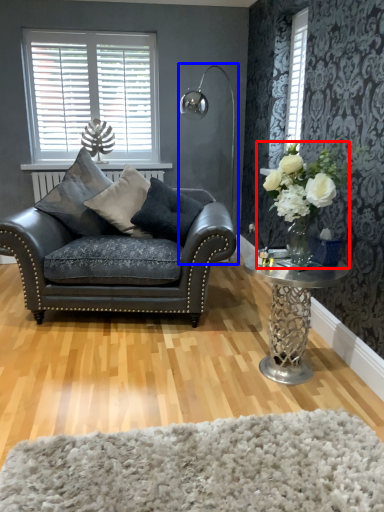
Question: Which point is further to the camera, floral arrangement (highlighted by a red box) or lamp (highlighted by a blue box)?

Choices:
 (A) floral arrangement
 (B) lamp

Answer: (B)